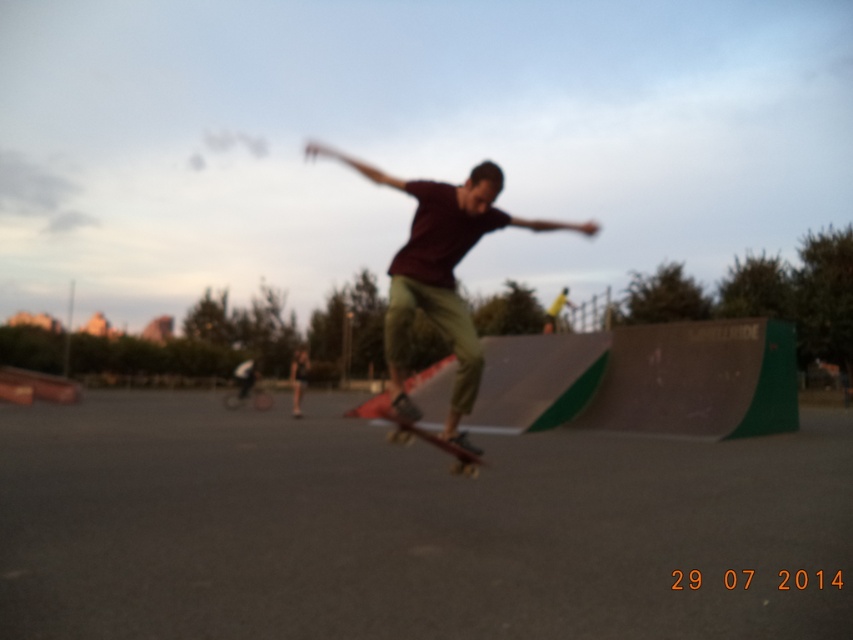
Question: Can you confirm if matte black skateboard at center is positioned above wooden skateboard at center?

Choices:
 (A) yes
 (B) no

Answer: (A)

Question: Is matte black skateboard at center positioned at the back of wooden skateboard at center?

Choices:
 (A) no
 (B) yes

Answer: (A)

Question: Can you confirm if matte black skateboard at center is positioned to the left of wooden skateboard at center?

Choices:
 (A) no
 (B) yes

Answer: (A)

Question: Among these objects, which one is farthest from the camera?

Choices:
 (A) wooden skateboard at center
 (B) matte black skateboard at center

Answer: (A)

Question: Which point is closer to the camera taking this photo?

Choices:
 (A) (445, 444)
 (B) (490, 225)

Answer: (B)